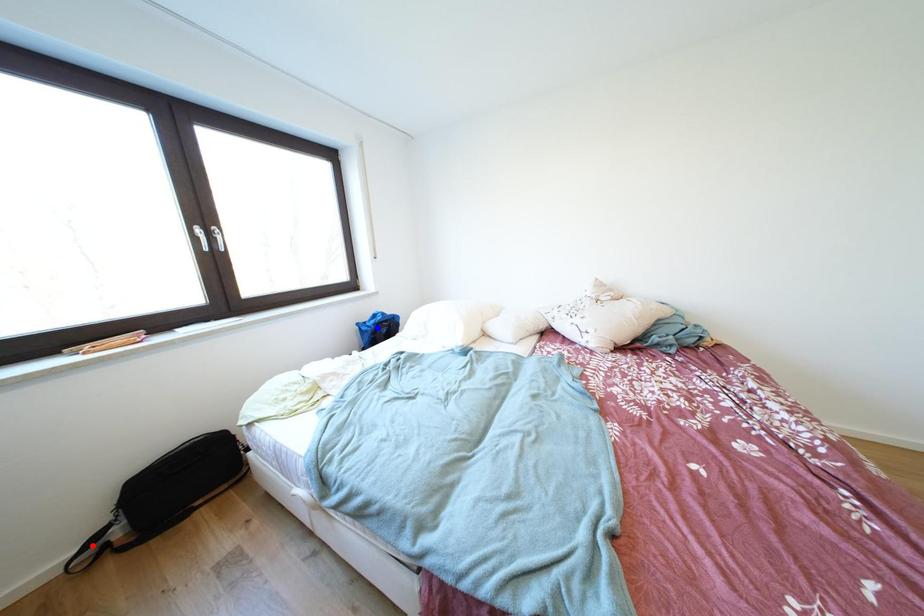
Question: In the image, two points are highlighted. Which point is nearer to the camera? Reply with the corresponding letter.

Choices:
 (A) blue point
 (B) red point

Answer: (B)